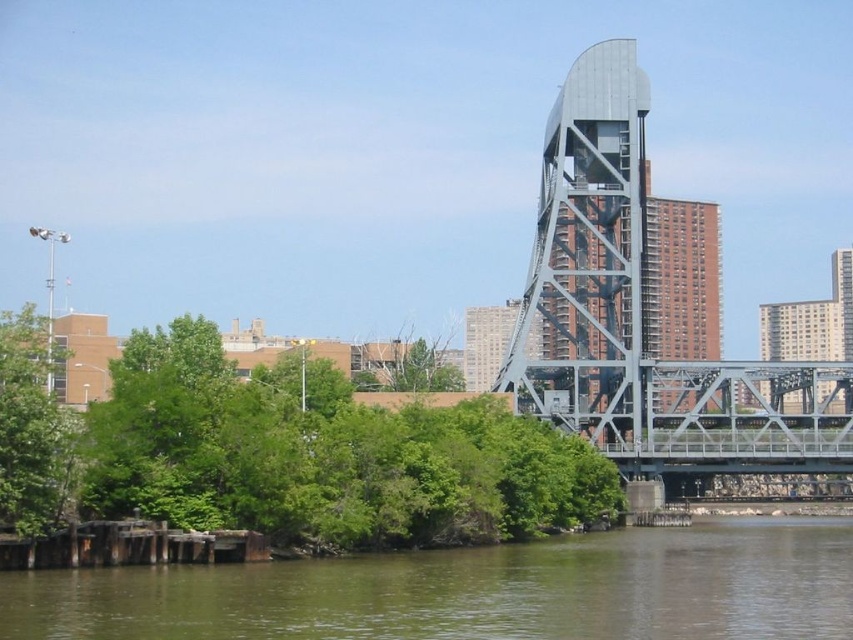
You are an architect planning to install a new sculpture in the riverside area. The sculpture requires a base that must be taller than the green leafy tree at left. Can the green water at lower center provide enough depth for the sculpture base? Explain your reasoning.

The green water at lower center is shorter than the green leafy tree at left. Since the sculpture base needs to be taller than the tree, the water depth may not be sufficient as it is shorter than the required height. However, the exact depth isn not specified, so further measurements are needed to confirm.

You are standing at the point marked by the coordinate point at (281, 452) in the image. Looking around, you see a green leafy tree at lower left. What direction should you face to see the large metallic structure in the midground?

The point at (281, 452) indicates the green leafy tree at lower left. To see the large metallic structure in the midground, you should face towards the center of the image, as the structure is positioned in the midground opposite to the lower left area.